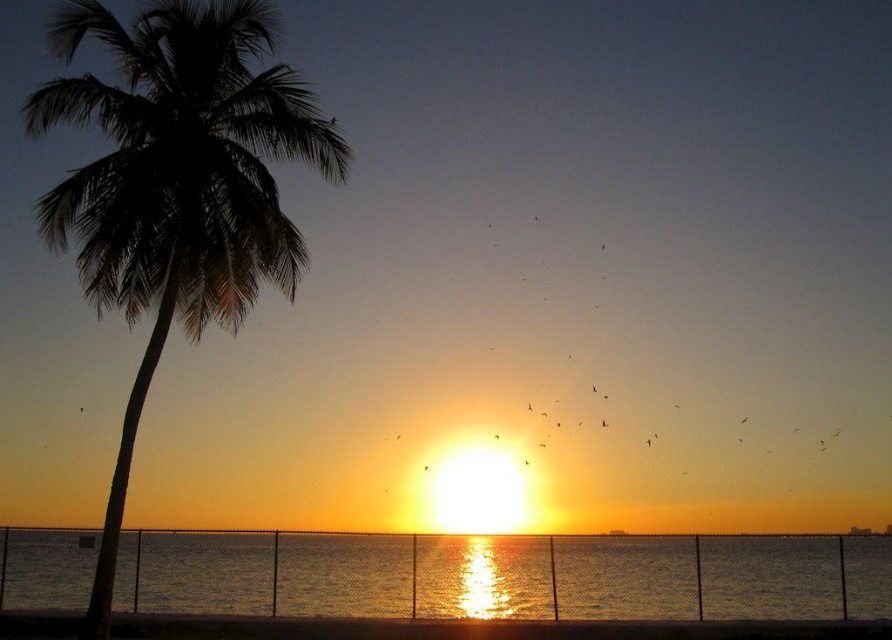
Which of these two, silhouette leafy palm at left or shiny metallic water at center, stands taller?

With more height is silhouette leafy palm at left.

Is silhouette leafy palm at left below shiny metallic water at center?

No.

What do you see at coordinates (176, 182) in the screenshot? I see `silhouette leafy palm at left` at bounding box center [176, 182].

Find the location of a particular element. silhouette leafy palm at left is located at coordinates (176, 182).

Which is below, shiny metallic water at center or smooth sand at lower center?

Positioned lower is shiny metallic water at center.

Which is more to the right, shiny metallic water at center or smooth sand at lower center?

Positioned to the right is shiny metallic water at center.

Who is more distant from viewer, (622,582) or (458,621)?

The point (622,582) is more distant.

I want to click on shiny metallic water at center, so click(506, 577).

This screenshot has width=892, height=640. I want to click on silhouette leafy palm at left, so click(176, 182).

Is silhouette leafy palm at left to the left of smooth sand at lower center from the viewer's perspective?

Yes, silhouette leafy palm at left is to the left of smooth sand at lower center.

You are a GUI agent. You are given a task and a screenshot of the screen. Output one action in this format:
    pyautogui.click(x=<x>, y=<y>)
    Task: Click on the silhouette leafy palm at left
    
    Given the screenshot: What is the action you would take?
    pyautogui.click(x=176, y=182)